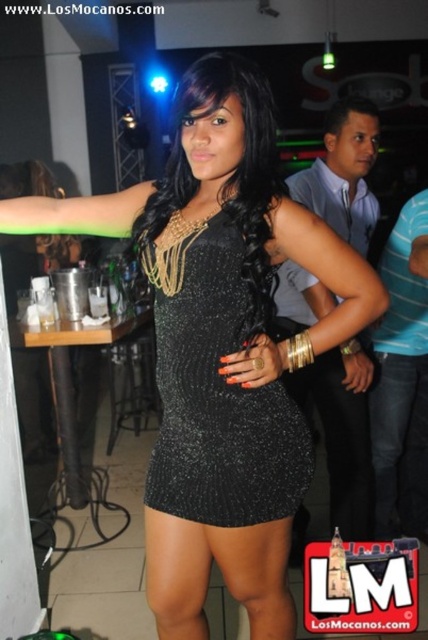
You are a photographer positioned at the entrance of the nightclub. You want to capture a photo that highlights both the black sequined dress at center and the denim at right. Considering their positions, which object will appear larger in the photo?

The black sequined dress at center will appear larger in the photo because it is closer to the viewer than the denim at right.

You are a photographer at the nightclub. You need to capture a photo of the black sequined dress at center and denim at right. Which object should you focus on first if you want to include both in the frame without moving the camera?

The black sequined dress at center is located above denim at right, so you should focus on the black sequined dress at center first to ensure both are in the frame.

You are a photographer at the nightclub and need to capture a shot of the black sequined dress at center and denim at right. Which object should you focus on first if you want to include both in the frame without moving the camera?

The black sequined dress at center is to the left of denim at right, so you should focus on the black sequined dress at center first to ensure both are in the frame.